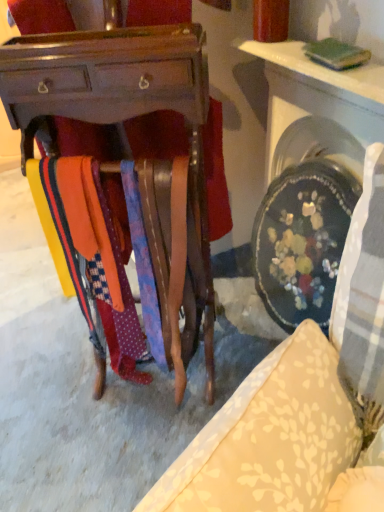
At what (x,y) coordinates should I click in order to perform the action: click on free space in front of wooden desk at center. Please return your answer as a coordinate pair (x, y). The image size is (384, 512). Looking at the image, I should click on (111, 444).